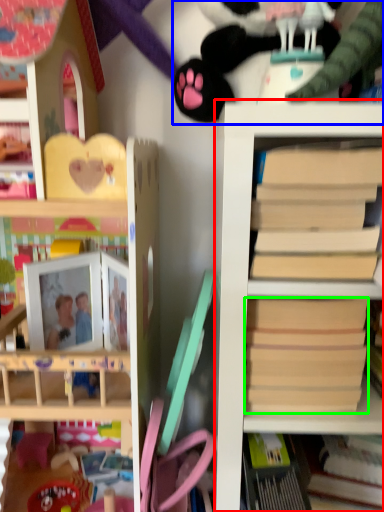
Question: Which is nearer to the shelf (highlighted by a red box)? toy (highlighted by a blue box) or paperback book (highlighted by a green box).

Choices:
 (A) toy
 (B) paperback book

Answer: (B)